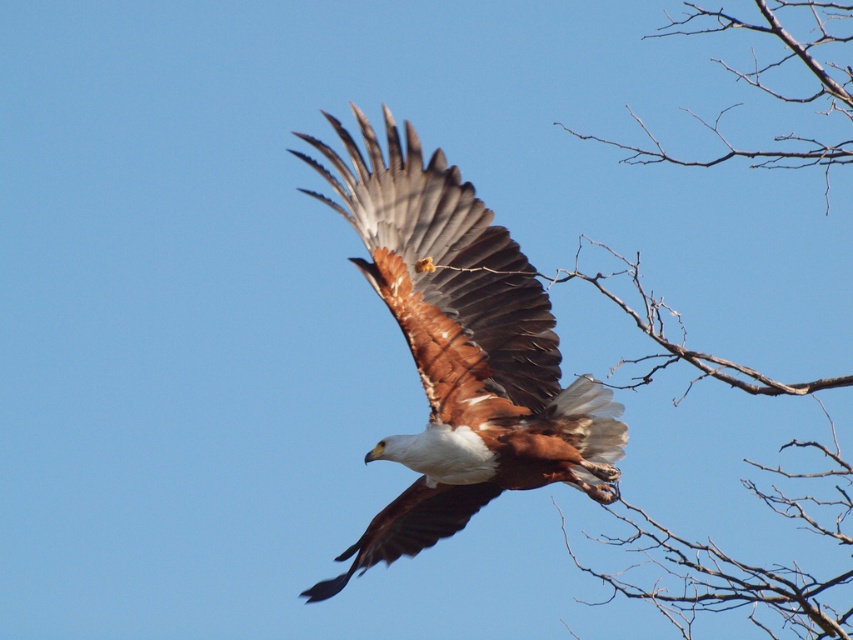
You are an ornithologist observing a bird in the sky. You notice the brown feathered eagle at center and the bare wood at upper right. Which object appears larger in the image?

The brown feathered eagle at center is smaller than the bare wood at upper right, so the bare wood at upper right appears larger.

You are observing a majestic bird of prey in mid flight. You notice two points on its body labeled as point [438,220] and point [717,365]. Which point is closer to you?

Point [438,220] is closer to the viewer than point [717,365].

You are an ornithologist studying the flight patterns of birds. You observe a majestic bird of prey in mid flight against a clear blue sky. The bird has a wingspan of 2 meters and is located at point (462,352). You need to determine if this bird is within the central 50x50 meter area of the observation zone. Can you confirm?

The point (462,352) corresponds to the brown feathered eagle at center, so yes, the bird is within the central 50x50 meter area of the observation zone.